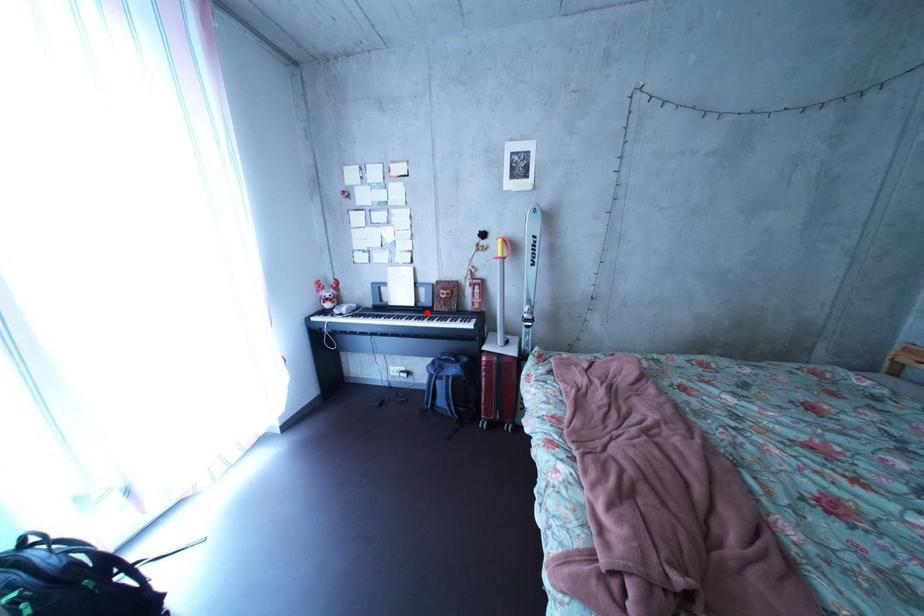
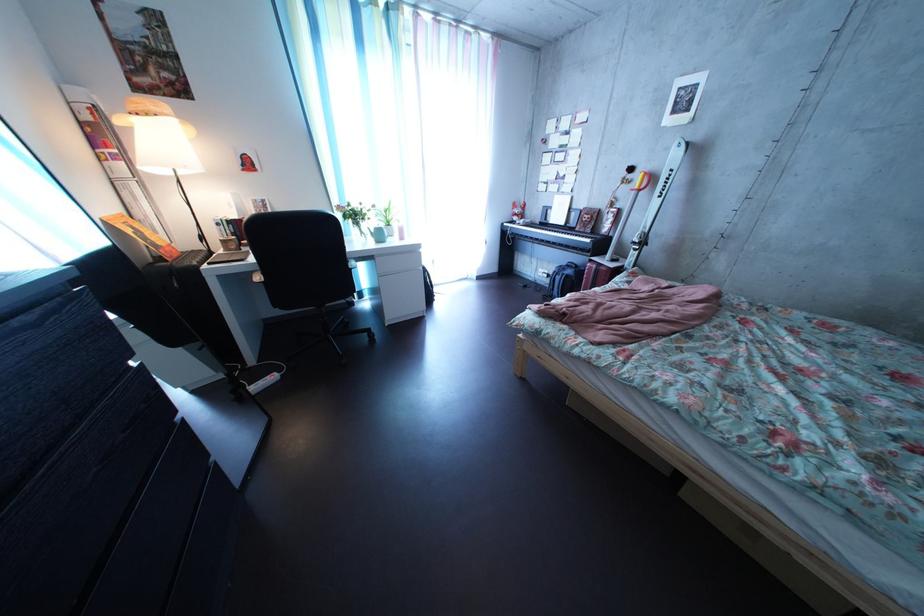
Question: I am providing you with two images of the same scene from different viewpoints. In image1, a red point is highlighted. Considering the same 3D point in image2, which of the following is correct?

Choices:
 (A) It is closer
 (B) It is farther

Answer: (A)